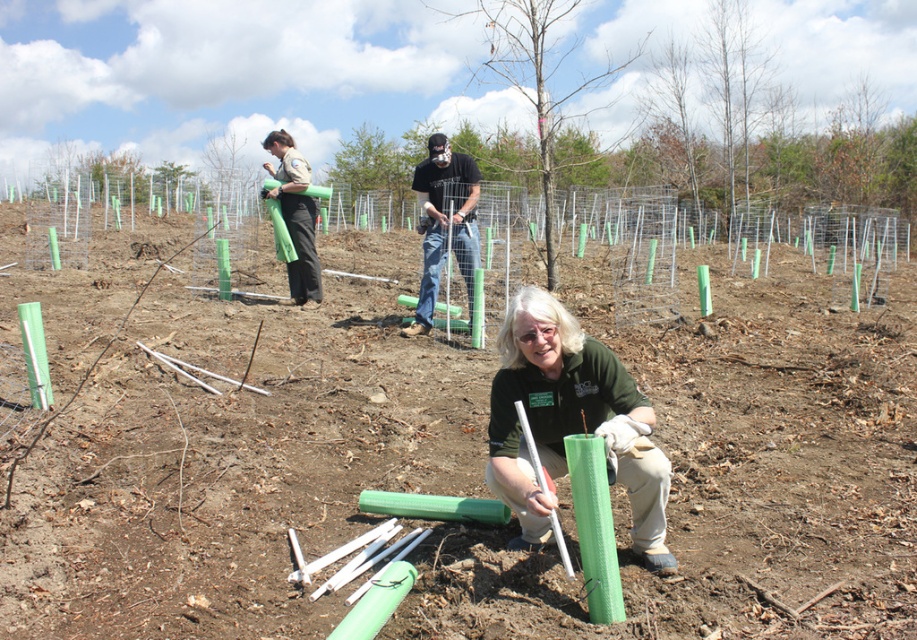
Question: Which of the following is the closest to the observer?

Choices:
 (A) green textured tube at center
 (B) smooth bark tree at center

Answer: (A)

Question: Does green textured tube at center appear over green matte tree at center?

Choices:
 (A) no
 (B) yes

Answer: (A)

Question: Which is farther from the brushed metal pipe at upper center?

Choices:
 (A) green textured tube at center
 (B) black matte shirt at center

Answer: (A)

Question: Does green textured tube at center appear over smooth green pole at upper left?

Choices:
 (A) yes
 (B) no

Answer: (B)

Question: Which object appears farthest from the camera in this image?

Choices:
 (A) smooth bark tree at center
 (B) black matte shirt at center
 (C) smooth green pole at upper left

Answer: (C)

Question: Is green textured tube at center positioned in front of black matte shirt at center?

Choices:
 (A) yes
 (B) no

Answer: (A)